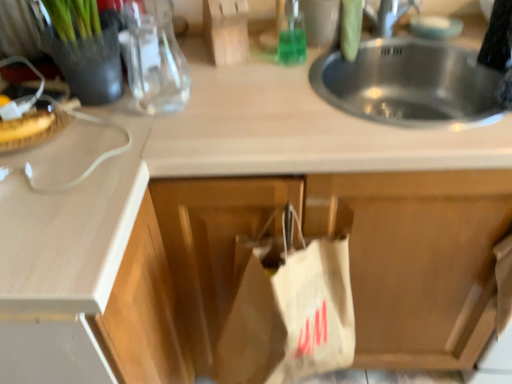
Question: Would you say white paper bag at center is to the left or to the right of white matte cabinet at center in the picture?

Choices:
 (A) right
 (B) left

Answer: (B)

Question: From the image's perspective, relative to white matte cabinet at center, is white paper bag at center above or below?

Choices:
 (A) above
 (B) below

Answer: (B)

Question: Which is farther from the green glass bottle at upper center, which appears as the 2th bottle when viewed from the left?

Choices:
 (A) white matte cabinet at center
 (B) breadtexturedat left
 (C) white paper bag at center
 (D) transparent glass bottle at upper left, arranged as the first bottle when viewed from the front

Answer: (B)

Question: Considering the real-world distances, which object is farthest from the white paper bag at center?

Choices:
 (A) green glass bottle at upper center, the 1th bottle viewed from the right
 (B) transparent glass bottle at upper left, arranged as the first bottle when viewed from the front
 (C) white matte cabinet at center
 (D) breadtexturedat left

Answer: (D)